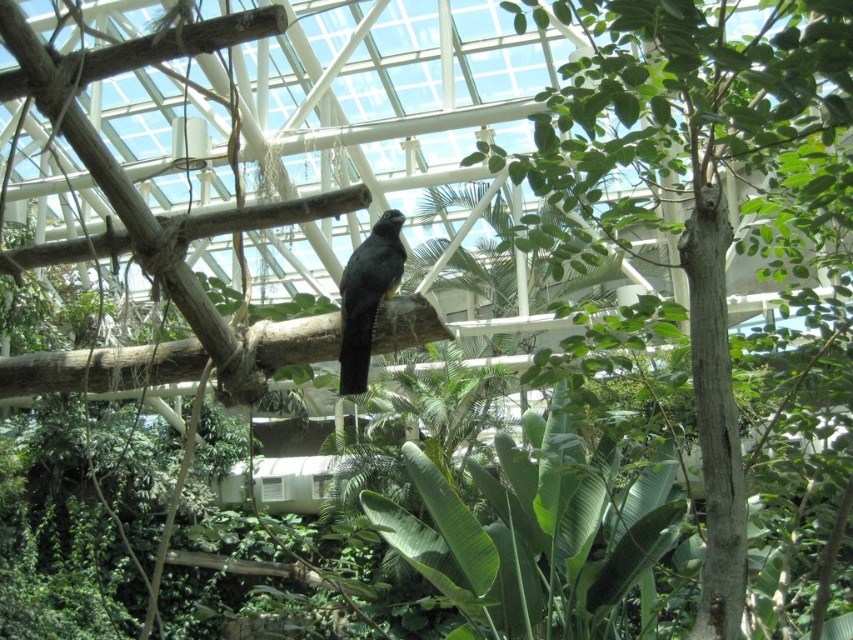
You are a visitor standing in the conservatory and want to take a selfie with the green rough bark tree at center. Your phone camera has a minimum focus distance of 1.5 meters. Can you take a clear photo without moving closer?

The green rough bark tree at center is 2.34 meters away from you, which is beyond the phone camera minimum focus distance of 1.5 meters. Therefore, you can take a clear photo without moving closer.

You are a small birdhouse builder who wants to place a birdhouse for the black glossy bird at center. Considering the height of the green rough bark tree at center, where should you place the birdhouse?

The green rough bark tree at center is much taller than the black glossy bird at center, so the birdhouse should be placed high up on the green rough bark tree at center to accommodate the bird.

From the picture: You are standing in the botanical garden and want to walk from the starting point to the exit. The starting point is marked by point 1 at coordinates point (793,145) and the exit is marked by point 2 at coordinates point (402,252). According to the spatial relationship between these two points, which direction should you move to reach the exit?

Point (793,145) is behind point (402,252), so you should move forward towards the exit at point (402,252).